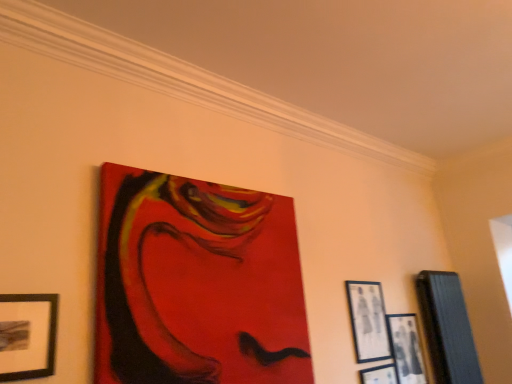
Question: Does matte black picture frame at lower right, which is the 3th picture frame from right to left, have a lesser height compared to black matte picture frame at lower right, the fourth picture frame viewed from the left?

Choices:
 (A) no
 (B) yes

Answer: (A)

Question: Is black matte picture frame at lower right, the fourth picture frame viewed from the left, surrounded by matte black picture frame at lower right, which appears as the third picture frame when viewed from the left?

Choices:
 (A) no
 (B) yes

Answer: (A)

Question: Is matte black picture frame at lower right, which is the 3th picture frame from right to left, wider than black matte picture frame at lower right, positioned as the 2th picture frame in right-to-left order?

Choices:
 (A) no
 (B) yes

Answer: (B)

Question: Is matte black picture frame at lower right, which is the 3th picture frame from right to left, positioned far away from black matte picture frame at lower right, positioned as the 2th picture frame in right-to-left order?

Choices:
 (A) no
 (B) yes

Answer: (A)

Question: Considering the relative positions of matte black picture frame at lower right, which is the 3th picture frame from right to left, and black matte picture frame at lower right, the fourth picture frame viewed from the left, in the image provided, is matte black picture frame at lower right, which is the 3th picture frame from right to left, to the right of black matte picture frame at lower right, the fourth picture frame viewed from the left, from the viewer's perspective?

Choices:
 (A) yes
 (B) no

Answer: (B)

Question: Is matte black picture frame at lower right, which is the 3th picture frame from right to left, smaller than black matte picture frame at lower right, positioned as the 2th picture frame in right-to-left order?

Choices:
 (A) no
 (B) yes

Answer: (A)

Question: Is wooden picture frame at right, which is the 5th picture frame in left-to-right order, in contact with matte black picture frame at upper right, which ranks as the 2th picture frame in left-to-right order?

Choices:
 (A) no
 (B) yes

Answer: (A)

Question: From a real-world perspective, is wooden picture frame at right, which is the 1th picture frame in right-to-left order, under matte black picture frame at upper right, which is the 4th picture frame from right to left?

Choices:
 (A) no
 (B) yes

Answer: (B)

Question: Is wooden picture frame at right, which is the 1th picture frame in right-to-left order, not close to matte black picture frame at upper right, which is the 4th picture frame from right to left?

Choices:
 (A) no
 (B) yes

Answer: (A)

Question: Is wooden picture frame at right, which is the 5th picture frame in left-to-right order, behind matte black picture frame at upper right, which is the 4th picture frame from right to left?

Choices:
 (A) yes
 (B) no

Answer: (A)

Question: Is wooden picture frame at right, which is the 1th picture frame in right-to-left order, oriented towards matte black picture frame at upper right, which ranks as the 2th picture frame in left-to-right order?

Choices:
 (A) no
 (B) yes

Answer: (A)

Question: Is wooden picture frame at right, which is the 5th picture frame in left-to-right order, to the right of matte black picture frame at upper right, which is the 4th picture frame from right to left, from the viewer's perspective?

Choices:
 (A) yes
 (B) no

Answer: (A)

Question: Would you say wooden picture frame at right, which is the 1th picture frame in right-to-left order, is part of matte acrylic painting at upper center, marked as the 5th picture frame in a right-to-left arrangement,'s contents?

Choices:
 (A) yes
 (B) no

Answer: (B)